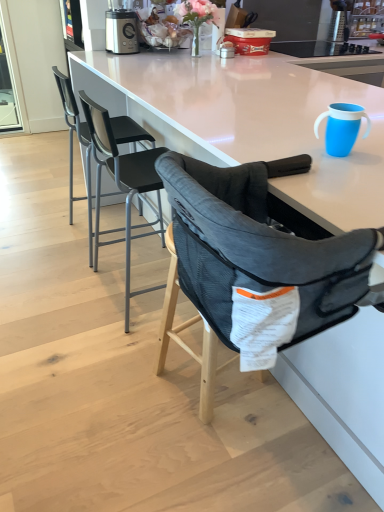
Identify the location of free spot in front of mesh fabric high chair at center. This screenshot has width=384, height=512. (201, 454).